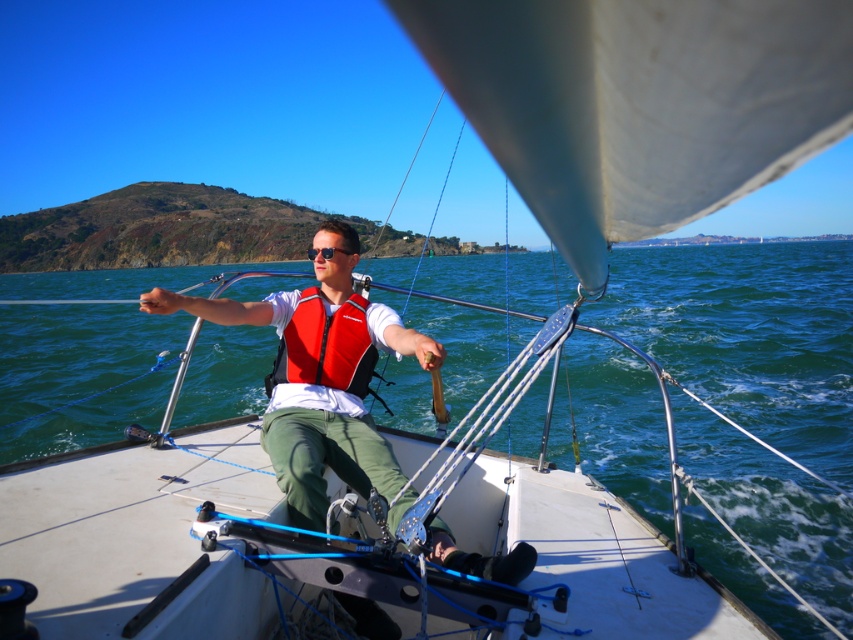
Question: Can you confirm if matte red life vest at center is smaller than sunglasses at center?

Choices:
 (A) yes
 (B) no

Answer: (B)

Question: Which is farther from the red nylon life jacket at center?

Choices:
 (A) sunglasses at center
 (B) matte red life vest at center

Answer: (A)

Question: Does matte red life vest at center appear on the left side of sunglasses at center?

Choices:
 (A) yes
 (B) no

Answer: (B)

Question: Does matte red life vest at center appear under sunglasses at center?

Choices:
 (A) no
 (B) yes

Answer: (B)

Question: Which point appears farthest from the camera in this image?

Choices:
 (A) (320, 248)
 (B) (334, 346)

Answer: (A)

Question: Considering the real-world distances, which object is closest to the red nylon life jacket at center?

Choices:
 (A) sunglasses at center
 (B) matte red life vest at center

Answer: (B)